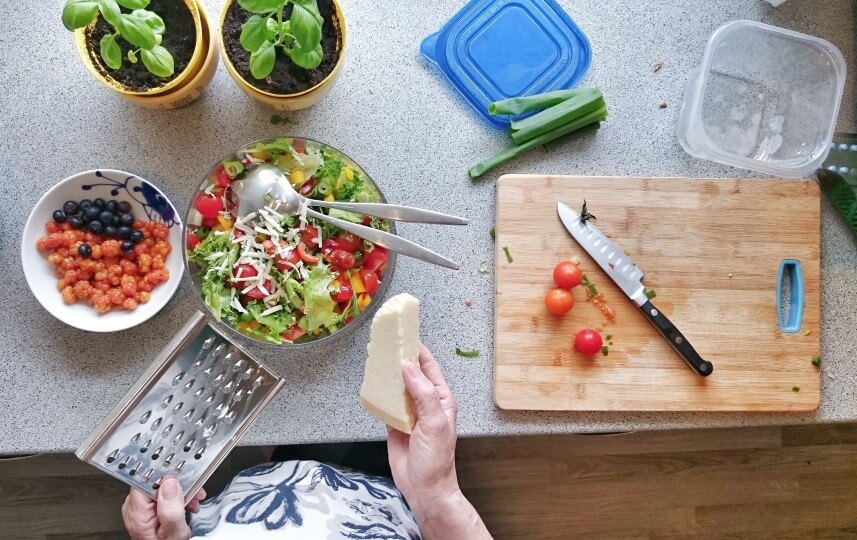
Identify the location of bowl of food storage container. The height and width of the screenshot is (540, 857). (717, 117).